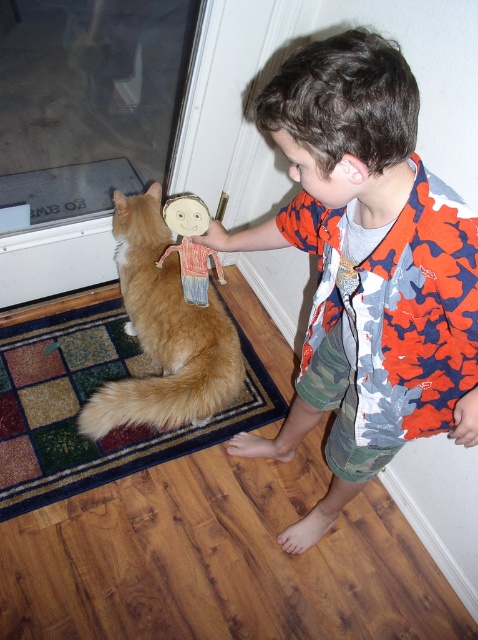
Is point (51, 198) more distant than point (173, 198)?

That is True.

Between point (78, 1) and point (198, 273), which one is positioned in front?

Positioned in front is point (198, 273).

Locate an element on the screen. Image resolution: width=478 pixels, height=640 pixels. transparent glass door at upper left is located at coordinates (84, 128).

The image size is (478, 640). What do you see at coordinates (366, 268) in the screenshot?
I see `camo-patterned shirt at center` at bounding box center [366, 268].

Who is more distant from viewer, (412, 301) or (183, 262)?

The point (183, 262) is more distant.

I want to click on camo-patterned shirt at center, so click(x=366, y=268).

In the scene shown: Between camo-patterned shirt at center and multicolored carpet at lower left, which one has more height?

camo-patterned shirt at center is taller.

Is camo-patterned shirt at center positioned at the back of multicolored carpet at lower left?

No, it is in front of multicolored carpet at lower left.

Image resolution: width=478 pixels, height=640 pixels. Describe the element at coordinates (366, 268) in the screenshot. I see `camo-patterned shirt at center` at that location.

Locate an element on the screen. This screenshot has height=640, width=478. camo-patterned shirt at center is located at coordinates (366, 268).